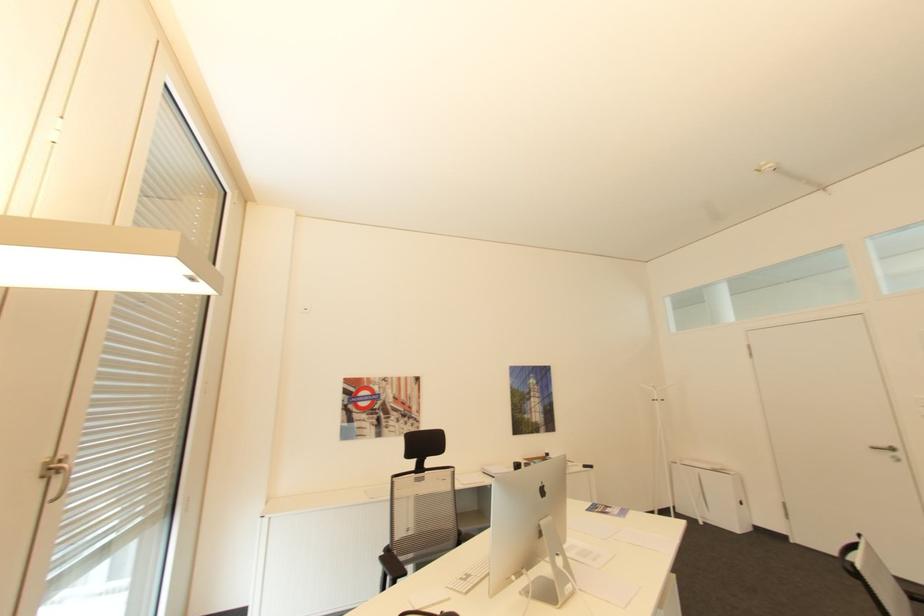
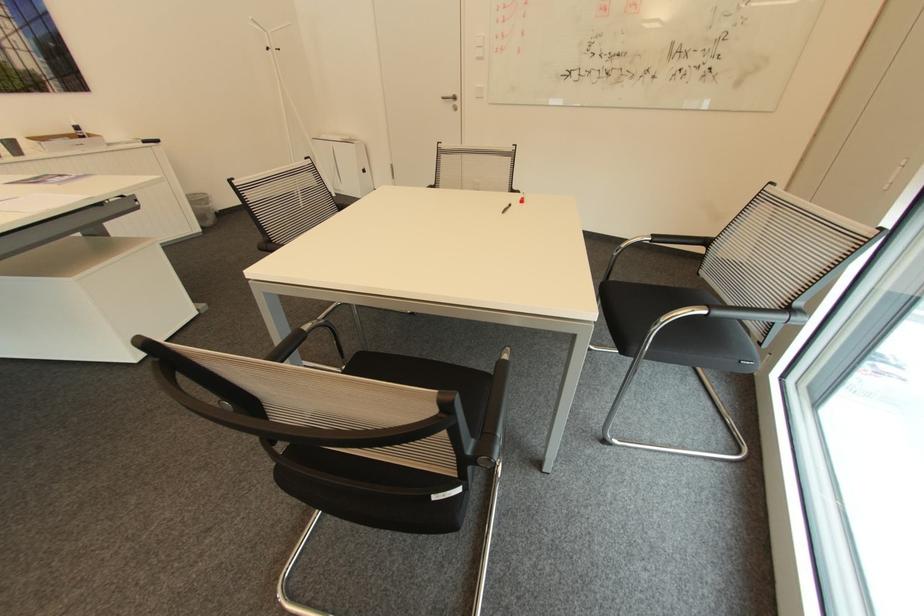
In the second image, find the point that corresponds to pixel 890 445 in the first image.

(456, 95)